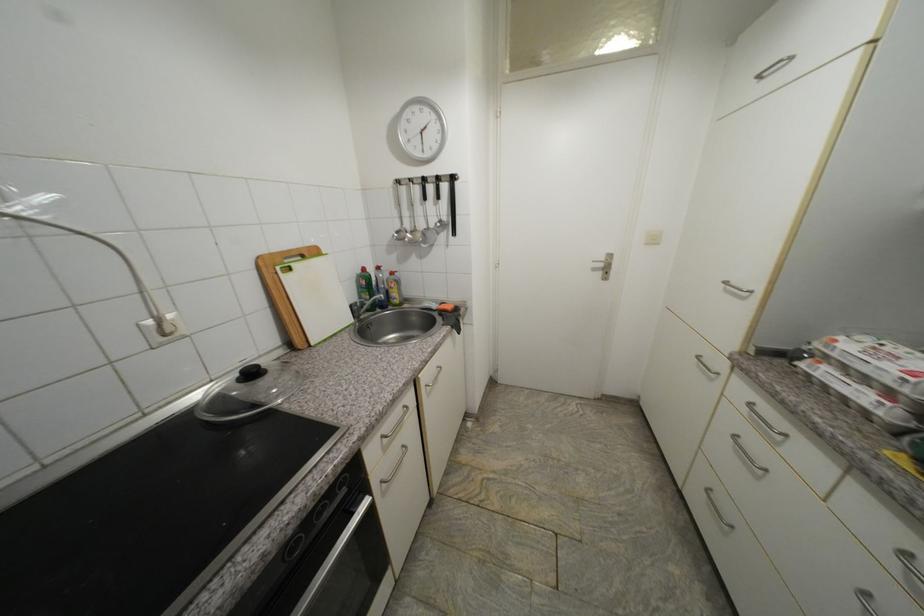
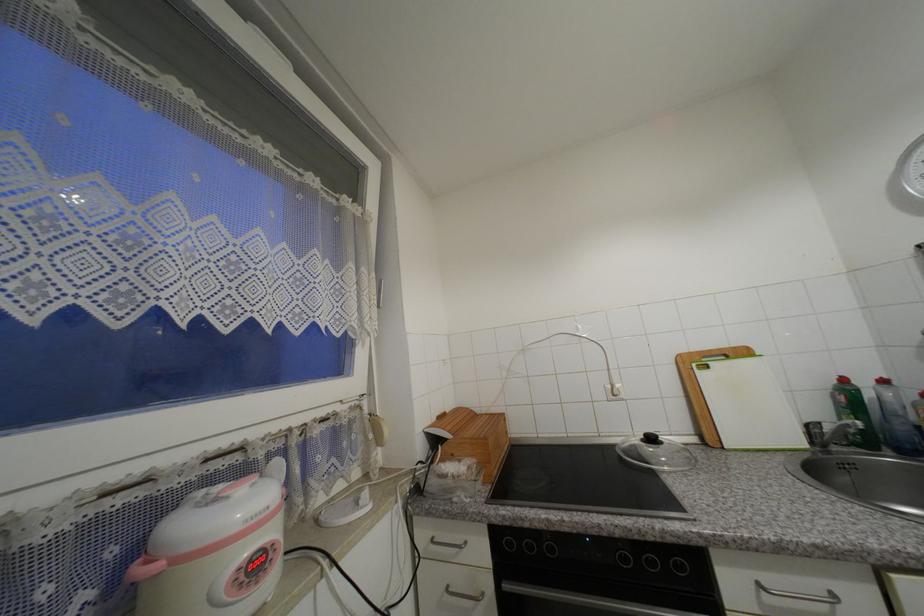
Find the pixel in the second image that matches (x=410, y=408) in the first image.

(840, 597)